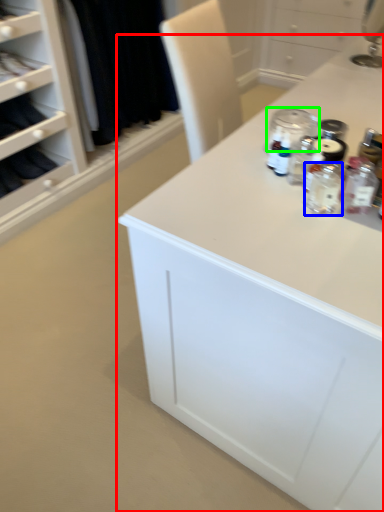
Question: Which is farther away from countertop (highlighted by a red box)? bottle (highlighted by a blue box) or glass jar (highlighted by a green box)?

Choices:
 (A) bottle
 (B) glass jar

Answer: (B)